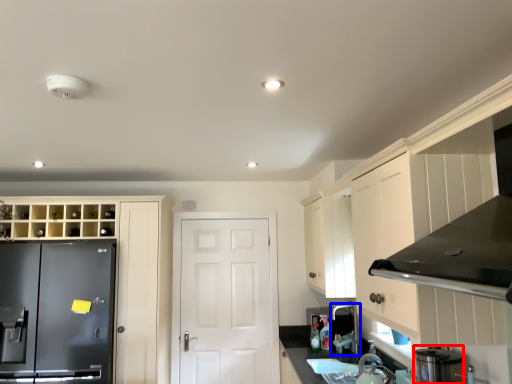
Question: Among these objects, which one is farthest to the camera, appliance (highlighted by a red box) or faucet (highlighted by a blue box)?

Choices:
 (A) appliance
 (B) faucet

Answer: (B)